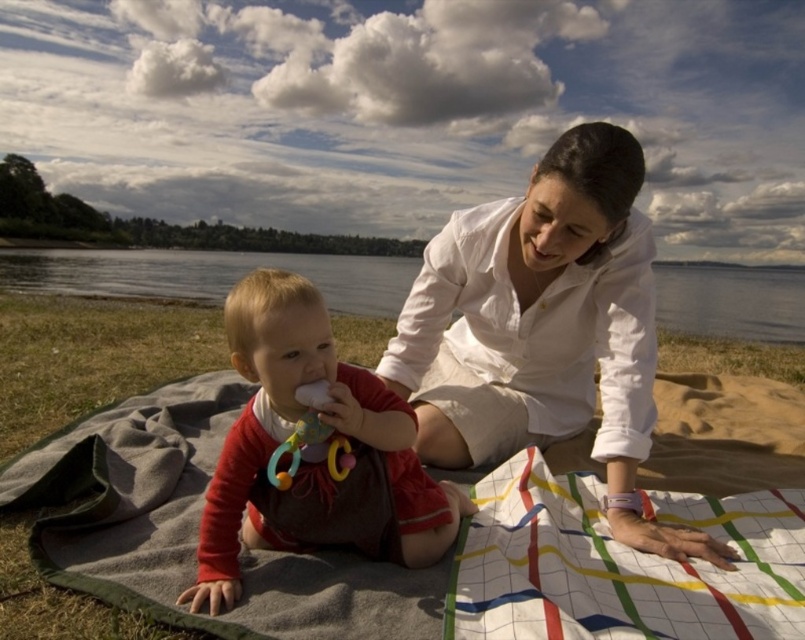
Question: Which object appears farthest from the camera in this image?

Choices:
 (A) clear water at center
 (B) white cotton shirt at upper center

Answer: (A)

Question: Can you confirm if white woven blanket at center is positioned to the right of white cotton shirt at upper center?

Choices:
 (A) yes
 (B) no

Answer: (B)

Question: Which of the following is the farthest from the observer?

Choices:
 (A) red cotton onesie at center
 (B) white woven blanket at center

Answer: (A)

Question: Is red cotton onesie at center behind rubber teething ring at center?

Choices:
 (A) no
 (B) yes

Answer: (A)

Question: Does white cotton shirt at upper center appear on the right side of rubber teething ring at center?

Choices:
 (A) yes
 (B) no

Answer: (A)

Question: Which of the following is the farthest from the observer?

Choices:
 (A) (428, 627)
 (B) (267, 362)
 (C) (345, 467)
 (D) (543, 388)

Answer: (D)